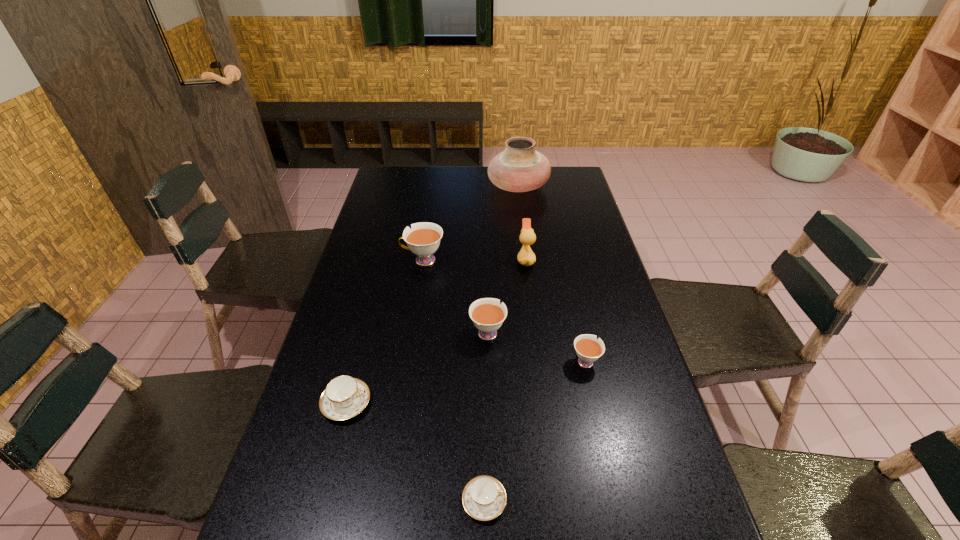
Image resolution: width=960 pixels, height=540 pixels. In order to click on free region located on the side of the fourth shortest teacup with the handle in this screenshot , I will do `click(487, 258)`.

Where is `free spot located 0.140m on the side of the fourth shortest teacup with the handle`? The image size is (960, 540). free spot located 0.140m on the side of the fourth shortest teacup with the handle is located at coordinates (487, 285).

Image resolution: width=960 pixels, height=540 pixels. What are the coordinates of `vacant space located on the side of the rightmost teacup with the handle` in the screenshot? It's located at (576, 321).

Where is `vacant region located on the side of the rightmost teacup with the handle`? vacant region located on the side of the rightmost teacup with the handle is located at coordinates (565, 274).

Find the location of a particular element. The height and width of the screenshot is (540, 960). vacant region located on the side of the rightmost teacup with the handle is located at coordinates (569, 288).

This screenshot has width=960, height=540. In order to click on vacant space located 0.330m on the side with the handle of the sixth farthest object in this screenshot , I will do `click(506, 403)`.

Identify the location of vacant space situated on the side with the handle of the shortest teacup. This screenshot has height=540, width=960. (569, 501).

You are a GUI agent. You are given a task and a screenshot of the screen. Output one action in this format:
    pyautogui.click(x=<x>, y=<y>)
    Task: Click on the object that is positioned at the far edge
    The width and height of the screenshot is (960, 540).
    Given the screenshot: What is the action you would take?
    pyautogui.click(x=520, y=168)

At what (x,y) coordinates should I click in order to perform the action: click on object that is at the left edge. Please return your answer as a coordinate pair (x, y). This screenshot has width=960, height=540. Looking at the image, I should click on (344, 397).

At what (x,y) coordinates should I click in order to perform the action: click on pottery that is positioned at the right edge. Please return your answer as a coordinate pair (x, y). Looking at the image, I should click on (520, 168).